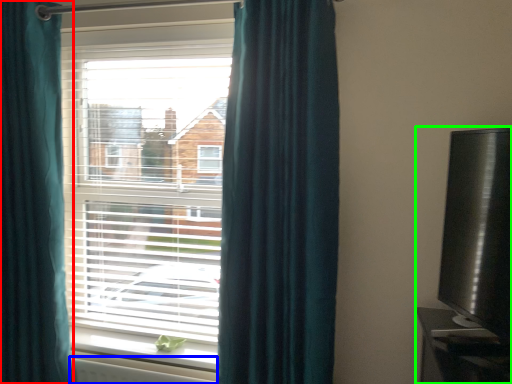
Question: Estimate the real-world distances between objects in this image. Which object is closer to curtain (highlighted by a red box), radiator (highlighted by a blue box) or entertainment center (highlighted by a green box)?

Choices:
 (A) radiator
 (B) entertainment center

Answer: (A)